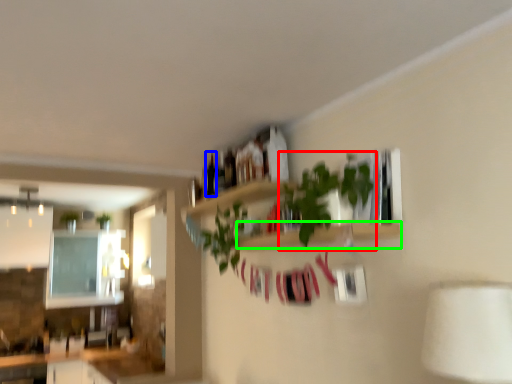
Question: Which is nearer to the houseplant (highlighted by a red box)? bottle (highlighted by a blue box) or shelf (highlighted by a green box).

Choices:
 (A) bottle
 (B) shelf

Answer: (B)